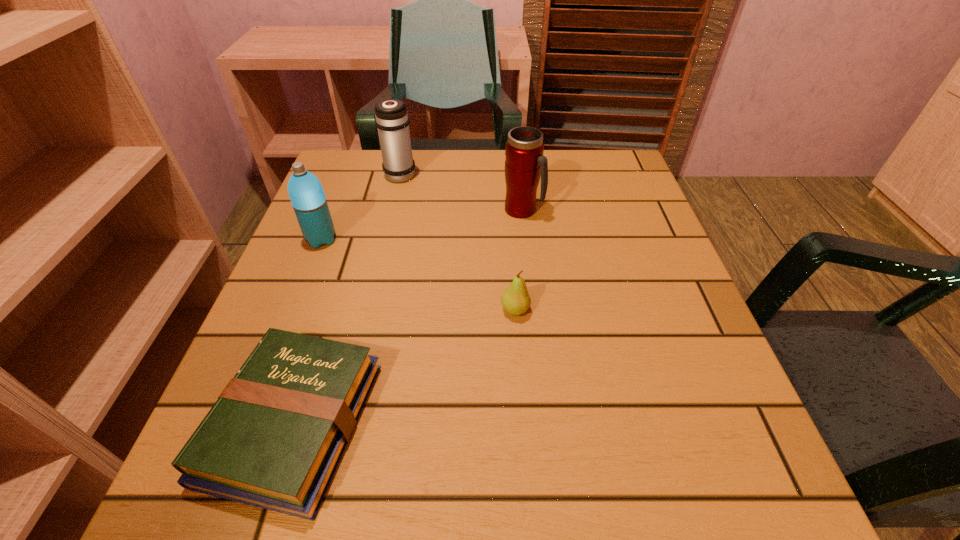
Find the location of a particular element. This screenshot has height=540, width=960. the farthest thermos bottle is located at coordinates (392, 121).

This screenshot has width=960, height=540. Identify the location of the second thermos bottle from left to right. (392, 121).

You are a GUI agent. You are given a task and a screenshot of the screen. Output one action in this format:
    pyautogui.click(x=<x>, y=<y>)
    Task: Click on the second farthest thermos bottle
    The height and width of the screenshot is (540, 960).
    Given the screenshot: What is the action you would take?
    pyautogui.click(x=525, y=163)

In order to click on the second farthest object in this screenshot , I will do `click(525, 163)`.

Find the location of a particular element. The width and height of the screenshot is (960, 540). the third farthest object is located at coordinates (306, 193).

Where is `the nearest thermos bottle`? This screenshot has width=960, height=540. the nearest thermos bottle is located at coordinates (306, 193).

Where is `pear`? The width and height of the screenshot is (960, 540). pear is located at coordinates (515, 300).

Find the location of `the fourth farthest object`. the fourth farthest object is located at coordinates (515, 300).

Image resolution: width=960 pixels, height=540 pixels. What are the coordinates of `the nearest object` in the screenshot? It's located at (274, 438).

Where is `book`? book is located at coordinates [274, 438].